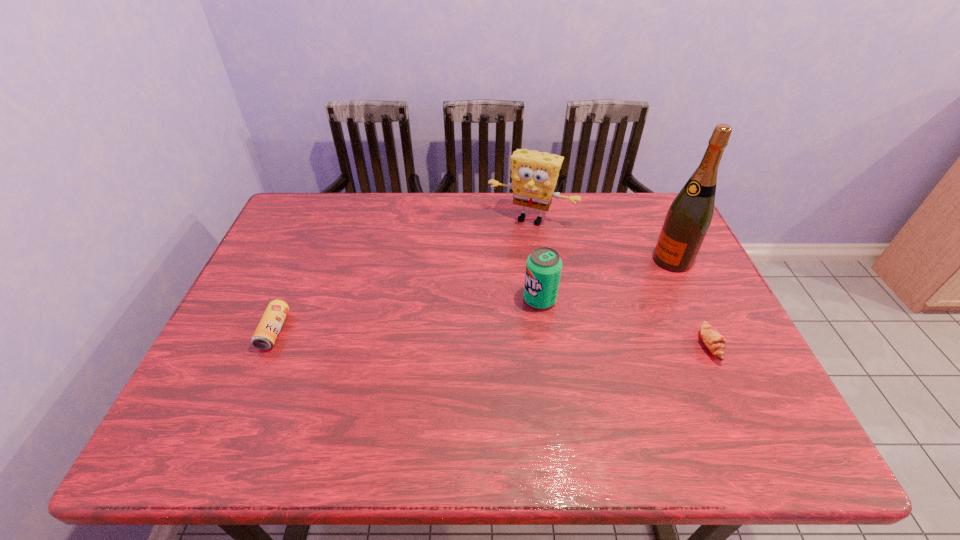
This screenshot has width=960, height=540. I want to click on vacant space situated 0.170m on the front-facing side of the third tallest object, so click(x=469, y=332).

Where is `vacant region located 0.250m on the front-facing side of the third tallest object`? The height and width of the screenshot is (540, 960). vacant region located 0.250m on the front-facing side of the third tallest object is located at coordinates (441, 345).

You are a GUI agent. You are given a task and a screenshot of the screen. Output one action in this format:
    pyautogui.click(x=<x>, y=<y>)
    Task: Click on the vacant space located on the face of the sponge
    
    Given the screenshot: What is the action you would take?
    pyautogui.click(x=511, y=242)

Locate an element on the screen. The height and width of the screenshot is (540, 960). vacant region located on the face of the sponge is located at coordinates (494, 275).

The height and width of the screenshot is (540, 960). What are the coordinates of `free point located 0.170m on the face of the sponge` in the screenshot? It's located at (500, 264).

Identify the location of free space located 0.380m on the front-facing side of the fourth nearest object. (558, 323).

I want to click on free space located on the front-facing side of the fourth nearest object, so click(x=628, y=285).

Image resolution: width=960 pixels, height=540 pixels. I want to click on vacant space located 0.270m on the front-facing side of the fourth nearest object, so click(x=590, y=306).

Image resolution: width=960 pixels, height=540 pixels. I want to click on object located in the far edge section of the desktop, so (534, 175).

Find the location of `object that is at the left edge`. object that is at the left edge is located at coordinates (265, 335).